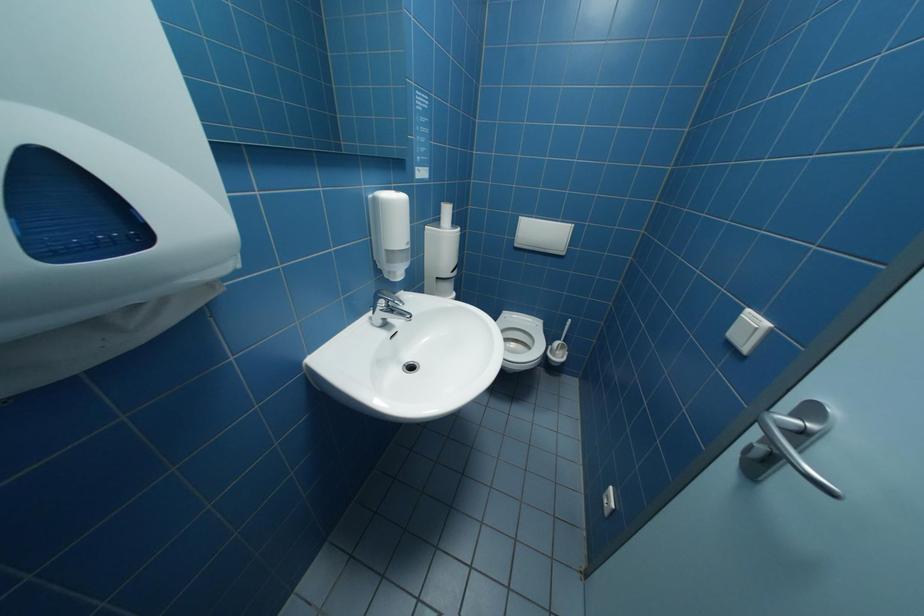
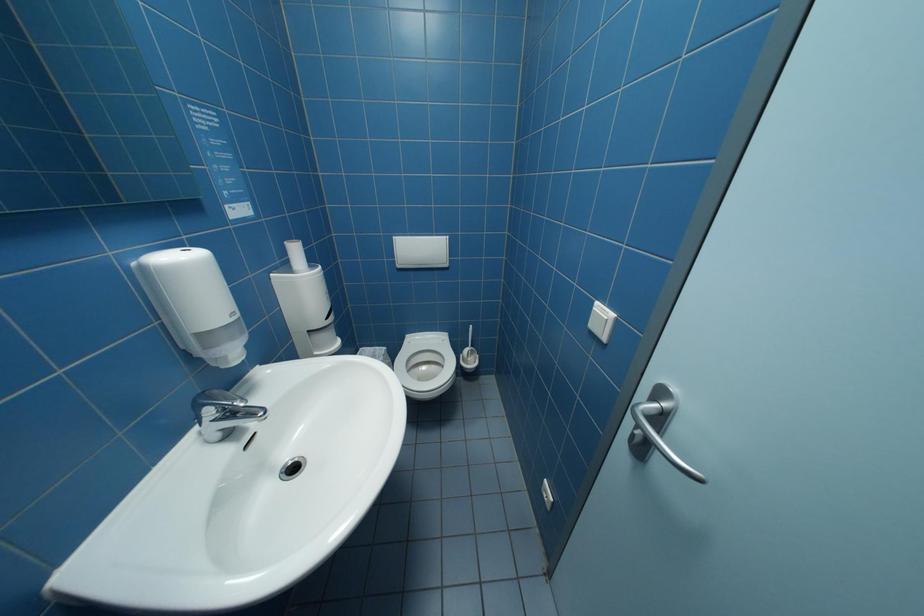
Which direction would the cameraman need to move to produce the second image?

The movement direction of the cameraman is right, forward.